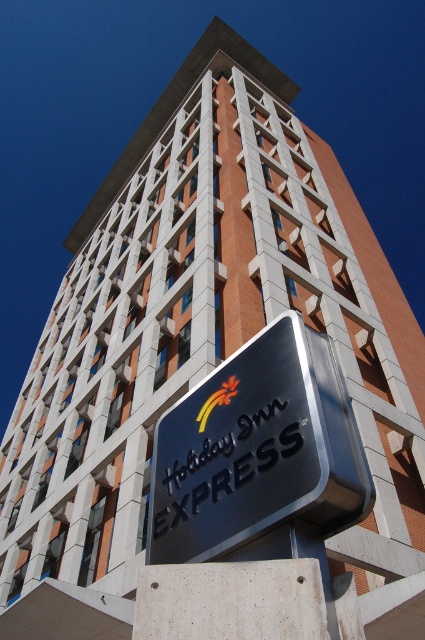
Is metallic silver sign at center behind yellowmaterial/texturelogo at lower center?

No, metallic silver sign at center is closer to the viewer.

Does metallic silver sign at center have a smaller size compared to yellowmaterial/texturelogo at lower center?

Actually, metallic silver sign at center might be larger than yellowmaterial/texturelogo at lower center.

Which is behind, point (195, 403) or point (201, 419)?

Point (195, 403)

Where is `metallic silver sign at center`? This screenshot has width=425, height=640. metallic silver sign at center is located at coordinates (260, 456).